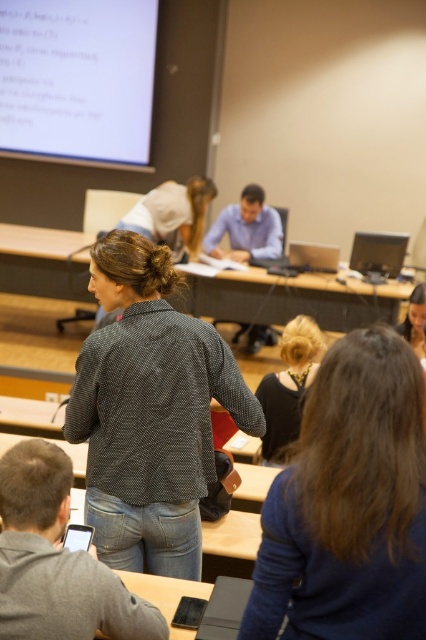
You are a student sitting at the back of the classroom and want to see the person presenting. Which object, the dark blue sweater at center or the dark brown hair at center, is closer to your line of sight?

The dark blue sweater at center is above the dark brown hair at center, so the dark blue sweater at center would be closer to your line of sight.

You are a student sitting at the desk in the middle of the classroom. You need to reach both the point at coordinates (34, 54) and the point at (267, 428) on your desk. Which point will you reach first without moving your chair?

You will reach the point at coordinates (34, 54) first because it is closer to you than the point at (267, 428), which is further away.

You are a student sitting at the back of the classroom. You notice two objects at the center of the room. Which one is closer to you, the dark blue sweater at center or the dark brown hair at center?

The dark blue sweater at center is closer to the viewer than the dark brown hair at center, so the dark blue sweater at center is closer to you.